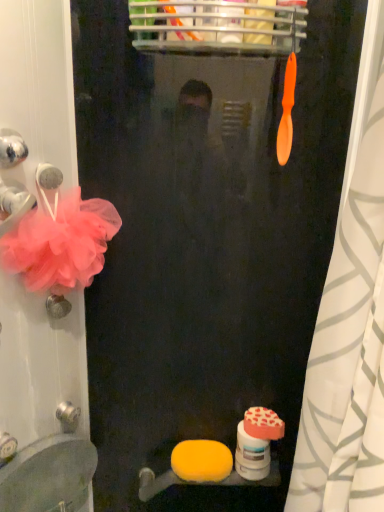
Question: Is orange matte shower curtain at right positioned beyond the bounds of yellow sponge at lower center, which is the first soap from left to right?

Choices:
 (A) yes
 (B) no

Answer: (A)

Question: Considering the relative sizes of orange matte shower curtain at right and yellow sponge at lower center, which is the first soap in bottom-to-top order, in the image provided, is orange matte shower curtain at right thinner than yellow sponge at lower center, which is the first soap in bottom-to-top order,?

Choices:
 (A) no
 (B) yes

Answer: (A)

Question: Is yellow sponge at lower center, which appears as the second soap when viewed from the right, at the back of orange matte shower curtain at right?

Choices:
 (A) yes
 (B) no

Answer: (A)

Question: Are orange matte shower curtain at right and yellow sponge at lower center, which is the first soap from left to right, beside each other?

Choices:
 (A) yes
 (B) no

Answer: (B)

Question: Considering the relative sizes of orange matte shower curtain at right and yellow sponge at lower center, which appears as the second soap when viewed from the right, in the image provided, is orange matte shower curtain at right taller than yellow sponge at lower center, which appears as the second soap when viewed from the right,?

Choices:
 (A) yes
 (B) no

Answer: (A)

Question: Is yellow sponge at lower center, arranged as the second soap when viewed from the top, completely or partially inside orange matte shower curtain at right?

Choices:
 (A) no
 (B) yes

Answer: (A)

Question: Considering the relative positions of orange matte shower curtain at right and matte white sink at lower left in the image provided, is orange matte shower curtain at right behind matte white sink at lower left?

Choices:
 (A) yes
 (B) no

Answer: (B)

Question: Is orange matte shower curtain at right aimed at matte white sink at lower left?

Choices:
 (A) no
 (B) yes

Answer: (A)

Question: Considering the relative sizes of orange matte shower curtain at right and matte white sink at lower left in the image provided, is orange matte shower curtain at right wider than matte white sink at lower left?

Choices:
 (A) no
 (B) yes

Answer: (B)

Question: Is orange matte shower curtain at right turned away from matte white sink at lower left?

Choices:
 (A) no
 (B) yes

Answer: (B)

Question: From the image's perspective, is orange matte shower curtain at right below matte white sink at lower left?

Choices:
 (A) no
 (B) yes

Answer: (A)

Question: Can you confirm if orange matte shower curtain at right is smaller than matte white sink at lower left?

Choices:
 (A) no
 (B) yes

Answer: (A)

Question: Are yellow sponge at lower center, which is the first soap from left to right, and pink tulle flower at left far apart?

Choices:
 (A) no
 (B) yes

Answer: (A)